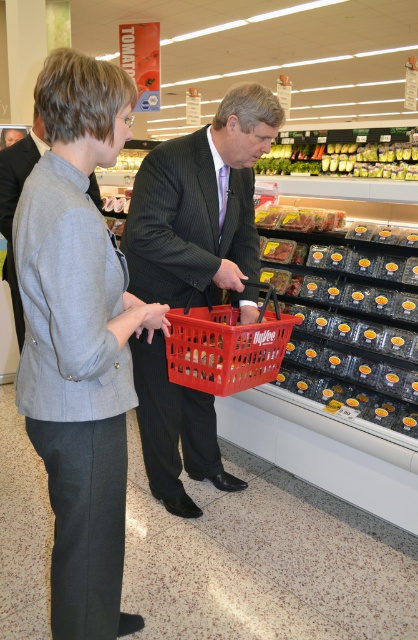
You are a fashion designer observing two individuals in the grocery store. You notice the dark gray pinstripe suit at center and the gray wool suit at center. Which of these suits is smaller in size?

The dark gray pinstripe suit at center is smaller than the gray wool suit at center.

You are a store employee and need to place a new sign about organic produce. The sign must be placed between the dark gray pinstripe suit at center and the green leafy vegetables at upper center. Where should you position the sign?

The sign should be placed to the right of the dark gray pinstripe suit at center and to the left of the green leafy vegetables at upper center since the dark gray pinstripe suit at center is to the left of the green leafy vegetables at upper center.

Looking at this image, you are a store employee who needs to ensure that the two customers in the produce section can comfortably pass each other. Given that the aisle is 1.2 meters wide, will the dark gray pinstripe suit at center and the gray wool suit at center be able to walk past each other without touching?

The dark gray pinstripe suit at center is narrower than the gray wool suit at center. Since the total width of both suits combined is less than 1.2 meters, they can pass each other comfortably without touching.